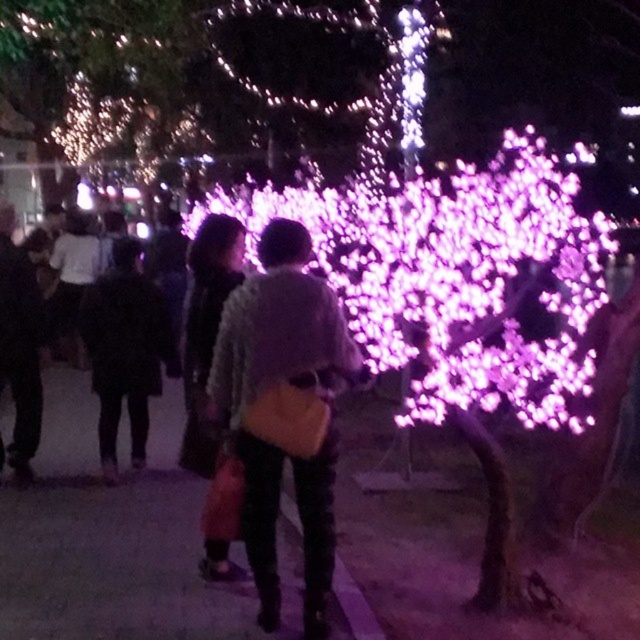
Question: Which of the following is the farthest from the observer?

Choices:
 (A) matte yellow bag at center
 (B) purple illuminated tree at center

Answer: (B)

Question: Can you confirm if illuminated plastic tree at upper left is positioned to the right of black leather jacket at left?

Choices:
 (A) no
 (B) yes

Answer: (A)

Question: Which of the following is the farthest from the observer?

Choices:
 (A) (173, 84)
 (B) (528, 288)

Answer: (A)

Question: Considering the real-world distances, which object is closest to the black leather jacket at left?

Choices:
 (A) illuminated plastic tree at upper left
 (B) matte yellow bag at center

Answer: (B)

Question: Does purple illuminated tree at center lie behind matte yellow bag at center?

Choices:
 (A) no
 (B) yes

Answer: (B)

Question: Can you confirm if purple illuminated tree at center is positioned to the right of matte yellow bag at center?

Choices:
 (A) no
 (B) yes

Answer: (B)